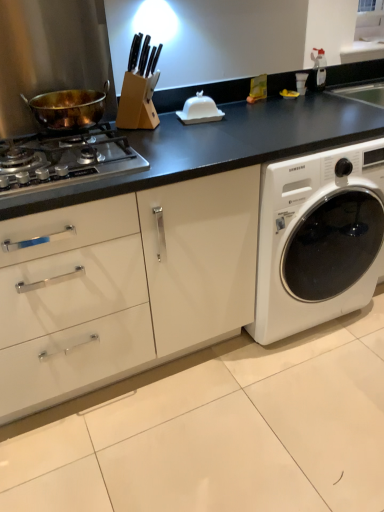
Question: Looking at the image, does white matte washing machine at center-right seem bigger or smaller compared to gold-bronze wok at left?

Choices:
 (A) small
 (B) big

Answer: (B)

Question: Considering the positions of white matte washing machine at center-right and gold-bronze wok at left in the image, is white matte washing machine at center-right wider or thinner than gold-bronze wok at left?

Choices:
 (A) wide
 (B) thin

Answer: (A)

Question: Considering the real-world distances, which object is farthest from the white matte washing machine at center-right?

Choices:
 (A) gold-bronze wok at left
 (B) stainless steel gas stove at left
 (C) white glossy butter dish at center

Answer: (A)

Question: Which is farther from the white matte washing machine at center-right?

Choices:
 (A) stainless steel gas stove at left
 (B) gold-bronze wok at left
 (C) white glossy butter dish at center

Answer: (B)